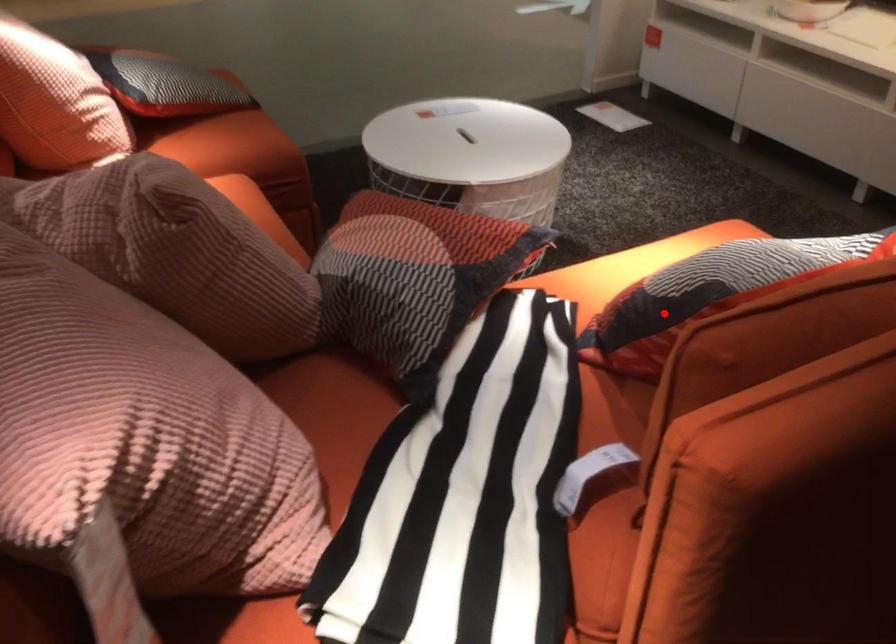
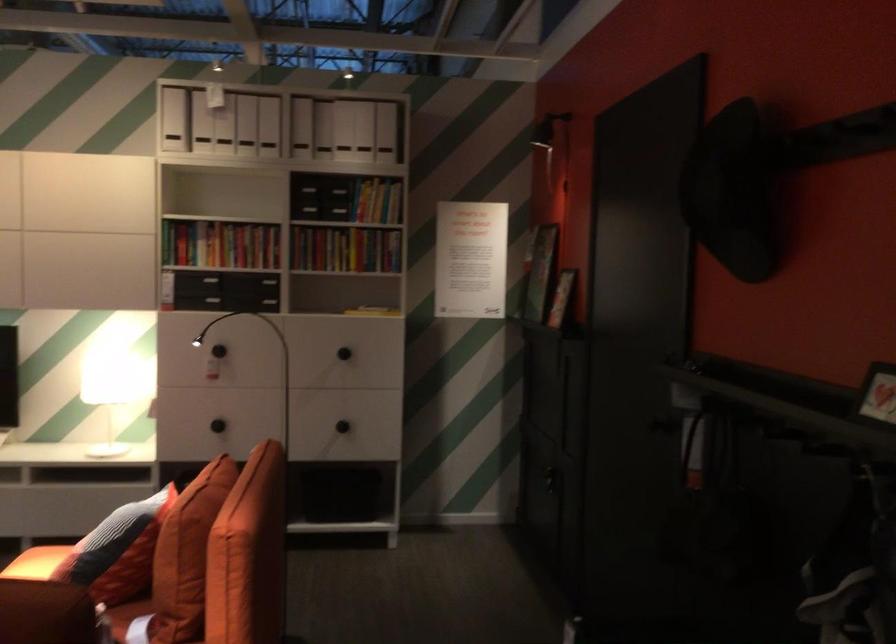
Question: A red point is marked in image1. In image2, is the corresponding 3D point closer to the camera or farther? Reply with the corresponding letter.

Choices:
 (A) The corresponding 3D point is closer.
 (B) The corresponding 3D point is farther.

Answer: (B)